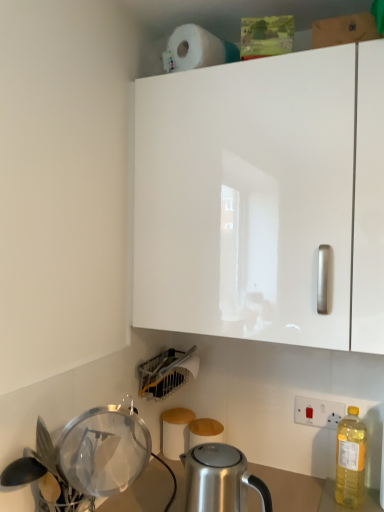
What do you see at coordinates (103, 450) in the screenshot?
I see `transparent plastic strainer at lower left, which appears as the 1th appliance when viewed from the front` at bounding box center [103, 450].

The width and height of the screenshot is (384, 512). I want to click on satin silver kettle at lower center, so click(220, 480).

The height and width of the screenshot is (512, 384). What do you see at coordinates (195, 48) in the screenshot?
I see `white matte paper towel at upper center` at bounding box center [195, 48].

Locate an element on the screen. The width and height of the screenshot is (384, 512). white glossy cabinet at upper center is located at coordinates (263, 198).

This screenshot has width=384, height=512. What do you see at coordinates (350, 459) in the screenshot?
I see `yellow translucent bottle at right` at bounding box center [350, 459].

Image resolution: width=384 pixels, height=512 pixels. Identify the location of transparent plastic strainer at lower left, the 2th appliance positioned from the back. (103, 450).

Is point (189, 502) positioned behind point (263, 334)?

No, (189, 502) is closer to viewer.

Is satin silver kettle at lower center situated inside white glossy cabinet at upper center or outside?

satin silver kettle at lower center lies outside white glossy cabinet at upper center.

From a real-world perspective, which is physically below, satin silver kettle at lower center or white glossy cabinet at upper center?

In real-world perspective, satin silver kettle at lower center is lower.

Does satin silver kettle at lower center turn towards white glossy cabinet at upper center?

No, satin silver kettle at lower center is not facing towards white glossy cabinet at upper center.

How different are the orientations of transparent plastic strainer at lower left, the 2th appliance positioned from the back, and yellow translucent bottle at right in degrees?

transparent plastic strainer at lower left, the 2th appliance positioned from the back, and yellow translucent bottle at right are facing 90.8 degrees away from each other.

Looking at this image, which is behind, transparent plastic strainer at lower left, the 2th appliance positioned from the back, or yellow translucent bottle at right?

yellow translucent bottle at right.

Between transparent plastic strainer at lower left, which appears as the 1th appliance when viewed from the front, and yellow translucent bottle at right, which one has larger width?

With larger width is transparent plastic strainer at lower left, which appears as the 1th appliance when viewed from the front.

In terms of size, does transparent plastic strainer at lower left, the 2th appliance positioned from the back, appear bigger or smaller than yellow translucent bottle at right?

transparent plastic strainer at lower left, the 2th appliance positioned from the back, is bigger than yellow translucent bottle at right.

I want to click on kettle on the left of the yellow translucent bottle at right, so click(220, 480).

Is point (347, 472) positioned in front of point (230, 509)?

No.

Which is more to the right, yellow translucent bottle at right or satin silver kettle at lower center?

yellow translucent bottle at right is more to the right.

Looking at this image, considering the sizes of objects white matte paper towel at upper center and white glossy cabinet at upper center in the image provided, who is bigger, white matte paper towel at upper center or white glossy cabinet at upper center?

white glossy cabinet at upper center.

Which is more to the right, white matte paper towel at upper center or white glossy cabinet at upper center?

From the viewer's perspective, white glossy cabinet at upper center appears more on the right side.

Is point (218, 38) positioned after point (190, 111)?

Yes.

Is white glossy cabinet at upper center surrounded by white matte paper towel at upper center?

No, white glossy cabinet at upper center is not inside white matte paper towel at upper center.

Does white matte toilet paper at lower center have a larger size compared to white matte paper towel at upper center?

Actually, white matte toilet paper at lower center might be smaller than white matte paper towel at upper center.

Which is in front, white matte toilet paper at lower center or white matte paper towel at upper center?

white matte paper towel at upper center.

Where is `toilet paper below the white matte paper towel at upper center (from the image's perspective)`? Image resolution: width=384 pixels, height=512 pixels. toilet paper below the white matte paper towel at upper center (from the image's perspective) is located at coordinates point(175,431).

Can white matte paper towel at upper center be found inside white matte toilet paper at lower center?

That's incorrect, white matte paper towel at upper center is not inside white matte toilet paper at lower center.

Can you confirm if transparent plastic strainer at lower left, the 2th appliance positioned from the back, is smaller than satin silver kettle at lower center?

Yes, transparent plastic strainer at lower left, the 2th appliance positioned from the back, is smaller than satin silver kettle at lower center.

What's the angular difference between transparent plastic strainer at lower left, which appears as the 1th appliance when viewed from the front, and satin silver kettle at lower center's facing directions?

They differ by 2.08 degrees in their facing directions.

From a real-world perspective, is transparent plastic strainer at lower left, the 2th appliance positioned from the back, physically above satin silver kettle at lower center?

Correct, in the physical world, transparent plastic strainer at lower left, the 2th appliance positioned from the back, is higher than satin silver kettle at lower center.

Which is in front, white glossy cabinet at upper center or white matte toilet paper at lower center?

Positioned in front is white glossy cabinet at upper center.

Which is closer to the camera, (270, 300) or (173, 428)?

The point (270, 300) is closer.

Is white glossy cabinet at upper center to the right of white matte toilet paper at lower center from the viewer's perspective?

Indeed, white glossy cabinet at upper center is positioned on the right side of white matte toilet paper at lower center.

From the image's perspective, is white glossy cabinet at upper center beneath white matte toilet paper at lower center?

Incorrect, from the image's perspective, white glossy cabinet at upper center is higher than white matte toilet paper at lower center.

Find the location of `cabinetry that appears above the satin silver kettle at lower center (from the image's perspective)`. cabinetry that appears above the satin silver kettle at lower center (from the image's perspective) is located at coordinates (263, 198).

Locate an element on the screen. The height and width of the screenshot is (512, 384). appliance lying in front of the yellow translucent bottle at right is located at coordinates pyautogui.click(x=103, y=450).

Based on their spatial positions, is white glossy cabinet at upper center or matte plastic dish rack at lower center, which ranks as the first appliance in back-to-front order, further from yellow translucent bottle at right?

The object further to yellow translucent bottle at right is white glossy cabinet at upper center.

Looking at this image, based on their spatial positions, is transparent plastic strainer at lower left, the 2th appliance positioned from the back, or satin silver kettle at lower center closer to white glossy cabinet at upper center?

satin silver kettle at lower center is positioned closer to the anchor white glossy cabinet at upper center.

From the image, which object appears to be farther from satin silver kettle at lower center, white matte paper towel at upper center or yellow translucent bottle at right?

white matte paper towel at upper center is positioned further to the anchor satin silver kettle at lower center.

When comparing their distances from satin silver kettle at lower center, does matte plastic dish rack at lower center, which ranks as the first appliance in back-to-front order, or yellow translucent bottle at right seem further?

Among the two, matte plastic dish rack at lower center, which ranks as the first appliance in back-to-front order, is located further to satin silver kettle at lower center.

From the image, which object appears to be farther from matte plastic dish rack at lower center, the second appliance from the front, white matte toilet paper at lower center or white matte paper towel at upper center?

Among the two, white matte paper towel at upper center is located further to matte plastic dish rack at lower center, the second appliance from the front.

Considering their positions, is transparent plastic strainer at lower left, which appears as the 1th appliance when viewed from the front, positioned closer to white matte paper towel at upper center than white matte toilet paper at lower center?

transparent plastic strainer at lower left, which appears as the 1th appliance when viewed from the front, is closer to white matte paper towel at upper center.

Considering their positions, is transparent plastic strainer at lower left, which appears as the 1th appliance when viewed from the front, positioned closer to white matte toilet paper at lower center than white glossy cabinet at upper center?

Based on the image, transparent plastic strainer at lower left, which appears as the 1th appliance when viewed from the front, appears to be nearer to white matte toilet paper at lower center.

From the image, which object appears to be nearer to matte plastic dish rack at lower center, which ranks as the first appliance in back-to-front order, transparent plastic strainer at lower left, the 2th appliance positioned from the back, or satin silver kettle at lower center?

satin silver kettle at lower center is closer to matte plastic dish rack at lower center, which ranks as the first appliance in back-to-front order.

You are a GUI agent. You are given a task and a screenshot of the screen. Output one action in this format:
    pyautogui.click(x=<x>, y=<y>)
    Task: Click on the kettle located between matte plastic dish rack at lower center, which ranks as the first appliance in back-to-front order, and yellow translucent bottle at right in the left-right direction
    
    Given the screenshot: What is the action you would take?
    pyautogui.click(x=220, y=480)

What are the coordinates of `toilet paper between transparent plastic strainer at lower left, the 2th appliance positioned from the back, and yellow translucent bottle at right from left to right` in the screenshot? It's located at (175, 431).

Where is `appliance between transparent plastic strainer at lower left, the 2th appliance positioned from the back, and yellow translucent bottle at right`? The height and width of the screenshot is (512, 384). appliance between transparent plastic strainer at lower left, the 2th appliance positioned from the back, and yellow translucent bottle at right is located at coordinates (165, 373).

You are a GUI agent. You are given a task and a screenshot of the screen. Output one action in this format:
    pyautogui.click(x=<x>, y=<y>)
    Task: Click on the appliance that lies between white matte paper towel at upper center and transparent plastic strainer at lower left, which appears as the 1th appliance when viewed from the front, from top to bottom
    
    Given the screenshot: What is the action you would take?
    pyautogui.click(x=165, y=373)